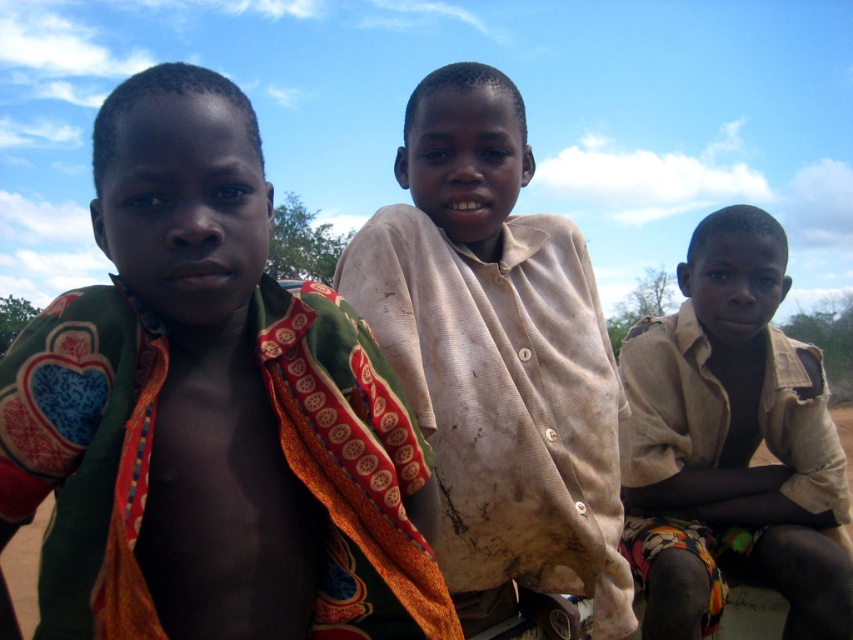
Question: Can you confirm if multicolored fabric at left is thinner than brown dirt field at lower center?

Choices:
 (A) no
 (B) yes

Answer: (B)

Question: From the image, what is the correct spatial relationship of multicolored fabric at left in relation to light brown cotton shirt at center?

Choices:
 (A) right
 (B) left

Answer: (B)

Question: Does multicolored fabric at left have a greater width compared to light brown cotton shirt at center?

Choices:
 (A) yes
 (B) no

Answer: (B)

Question: Among these objects, which one is nearest to the camera?

Choices:
 (A) multicolored fabric at left
 (B) light brown cotton shirt at center
 (C) brown dirt field at lower center

Answer: (A)

Question: Which object is closer to the camera taking this photo?

Choices:
 (A) multicolored fabric at left
 (B) light brown cotton shirt at center

Answer: (A)

Question: Among these points, which one is farthest from the camera?

Choices:
 (A) (824, 394)
 (B) (469, 182)
 (C) (10, 586)
 (D) (407, 508)

Answer: (C)